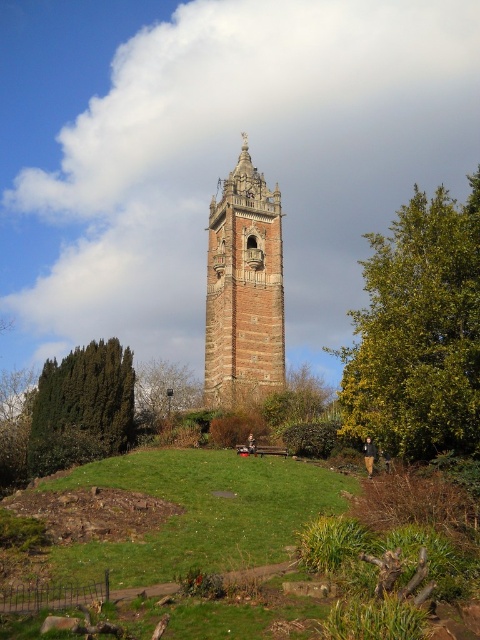
Who is shorter, green leafy tree at lower left or green leafy tree at center?

green leafy tree at center is shorter.

Between green leafy tree at lower left and green leafy tree at center, which one appears on the left side from the viewer's perspective?

From the viewer's perspective, green leafy tree at lower left appears more on the left side.

Is point (48, 378) positioned behind point (141, 380)?

No, it is not.

Identify the location of green leafy tree at lower left. (83, 406).

Is brick stonework clock tower at center behind green leafy tree at center?

No, brick stonework clock tower at center is in front of green leafy tree at center.

Is brick stonework clock tower at center smaller than green leafy tree at center?

No, brick stonework clock tower at center is not smaller than green leafy tree at center.

Which is in front, point (271, 364) or point (143, 369)?

Point (271, 364)

I want to click on brick stonework clock tower at center, so [x=243, y=288].

Can you confirm if green leafy tree at center-right is wider than green leafy tree at lower left?

Yes, green leafy tree at center-right is wider than green leafy tree at lower left.

Does point (417, 442) lie behind point (33, 442)?

No, it is in front of (33, 442).

This screenshot has width=480, height=640. In order to click on green leafy tree at center-right in this screenshot , I will do `click(419, 332)`.